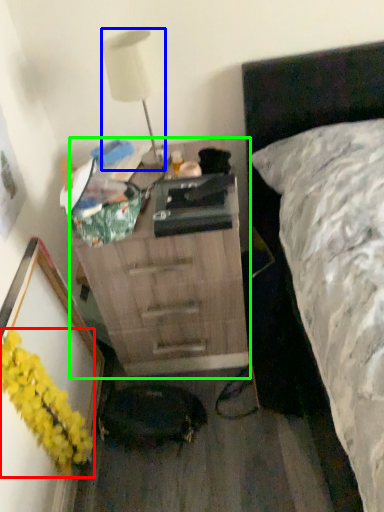
Question: Considering the real-world distances, which object is farthest from flower (highlighted by a red box)? lamp (highlighted by a blue box) or chest of drawers (highlighted by a green box)?

Choices:
 (A) lamp
 (B) chest of drawers

Answer: (A)